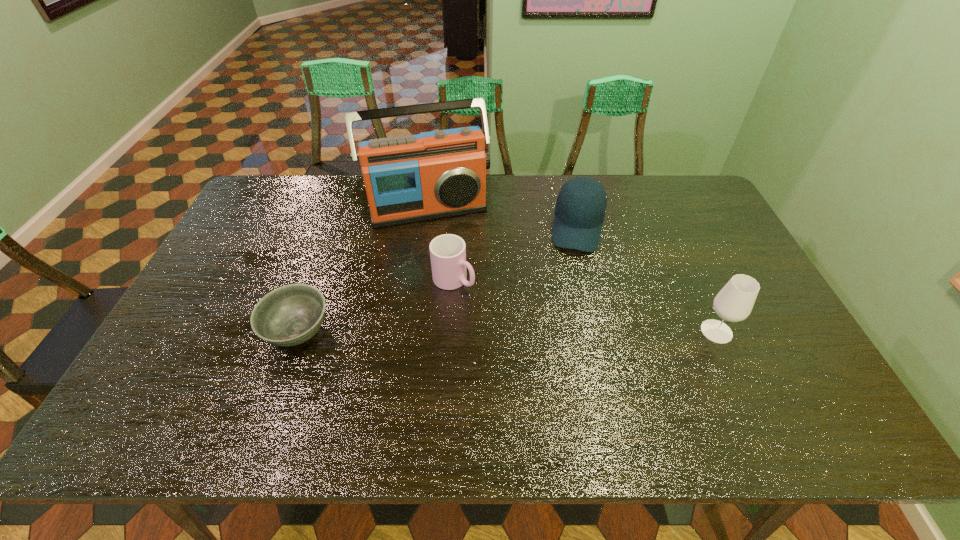
Find the location of `the shortest object`. the shortest object is located at coordinates (290, 315).

Identify the location of the rightmost object. This screenshot has width=960, height=540. (734, 303).

Find the location of `the second tallest object`. the second tallest object is located at coordinates (734, 303).

Find the location of a particular element. The width and height of the screenshot is (960, 540). baseball cap is located at coordinates (580, 209).

This screenshot has height=540, width=960. Identify the location of the third shortest object. (580, 209).

I want to click on the third farthest object, so click(x=448, y=251).

Identify the location of the fourth tallest object. (448, 251).

You are a GUI agent. You are given a task and a screenshot of the screen. Output one action in this format:
    pyautogui.click(x=<x>, y=<y>)
    Task: Click on the tallest object
    
    Given the screenshot: What is the action you would take?
    pyautogui.click(x=437, y=174)

What are the coordinates of `free space located on the right of the shortest object` in the screenshot? It's located at (383, 331).

Identify the location of blank area located on the left of the second tallest object. (646, 332).